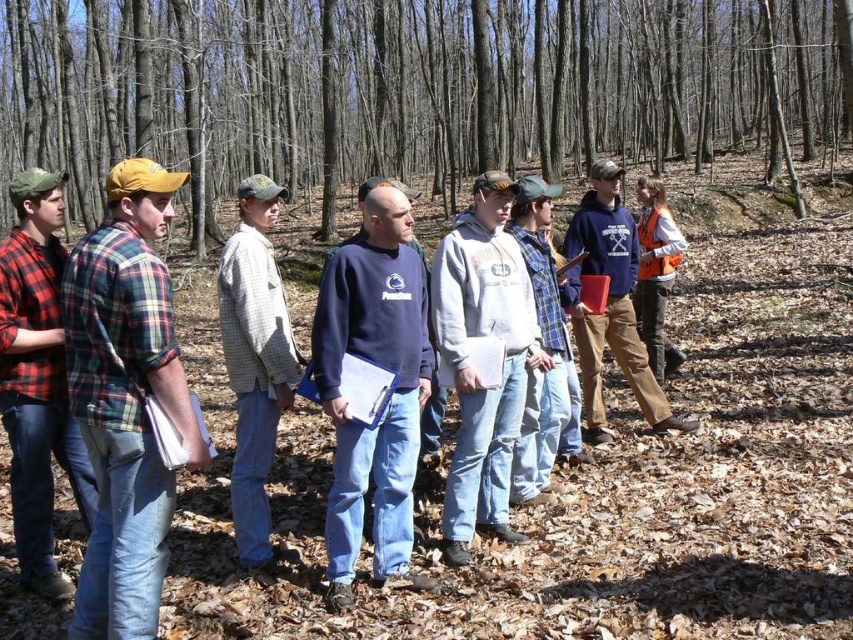
Question: Does plaid flannel shirt at left have a larger size compared to red plaid shirt at left?

Choices:
 (A) no
 (B) yes

Answer: (B)

Question: Considering the real-world distances, which object is farthest from the brown bark tree at center?

Choices:
 (A) red plaid shirt at left
 (B) plaid flannel shirt at left
 (C) matte blue sweatshirt at center

Answer: (A)

Question: Does red plaid shirt at left appear under matte blue sweatshirt at center?

Choices:
 (A) no
 (B) yes

Answer: (B)

Question: Observing the image, what is the correct spatial positioning of dark blue fleece sweatshirt at center in reference to red plaid shirt at left?

Choices:
 (A) left
 (B) right

Answer: (B)

Question: Which point is closer to the camera?

Choices:
 (A) (132, 493)
 (B) (235, 304)

Answer: (A)

Question: Among these points, which one is nearest to the camera?

Choices:
 (A) (585, 412)
 (B) (15, 193)

Answer: (B)